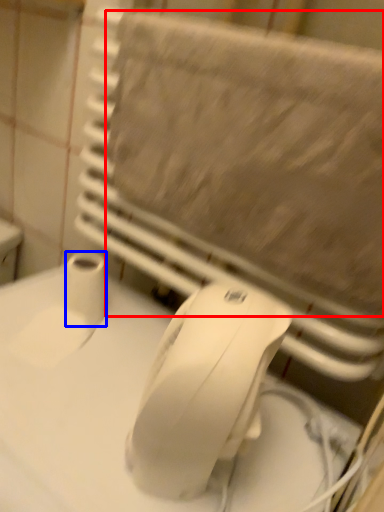
Question: Which object is further to the camera taking this photo, bath towel (highlighted by a red box) or toilet paper (highlighted by a blue box)?

Choices:
 (A) bath towel
 (B) toilet paper

Answer: (B)